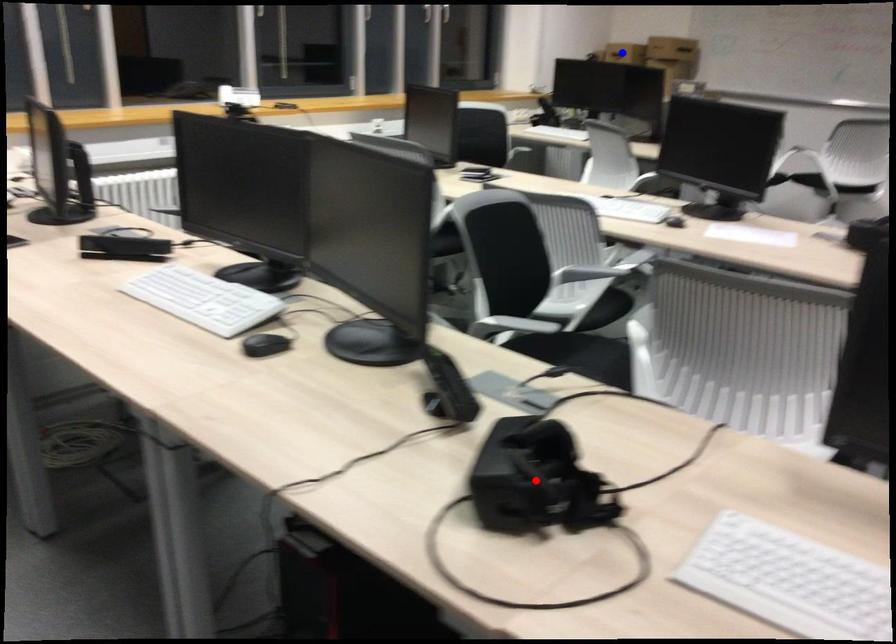
Question: Two points are marked on the image. Which point is closer to the camera?

Choices:
 (A) Blue point is closer.
 (B) Red point is closer.

Answer: (B)